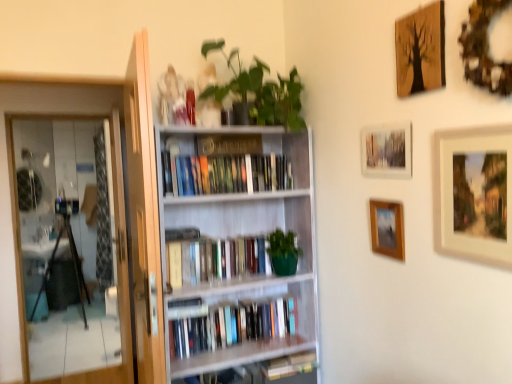
Where is `empty space that is ontop of transparent glass screen door at left (from a real-world perspective)`? The width and height of the screenshot is (512, 384). empty space that is ontop of transparent glass screen door at left (from a real-world perspective) is located at coordinates (61, 117).